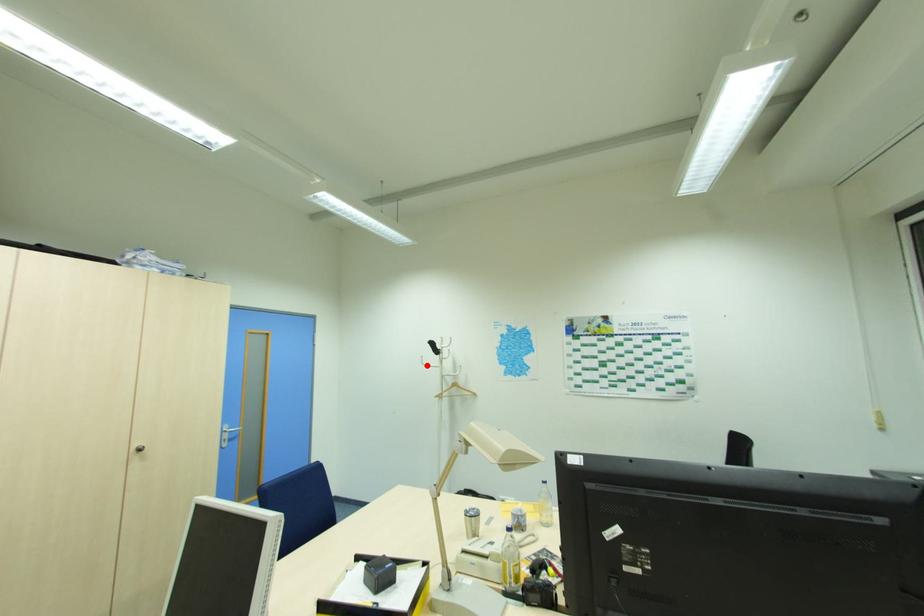
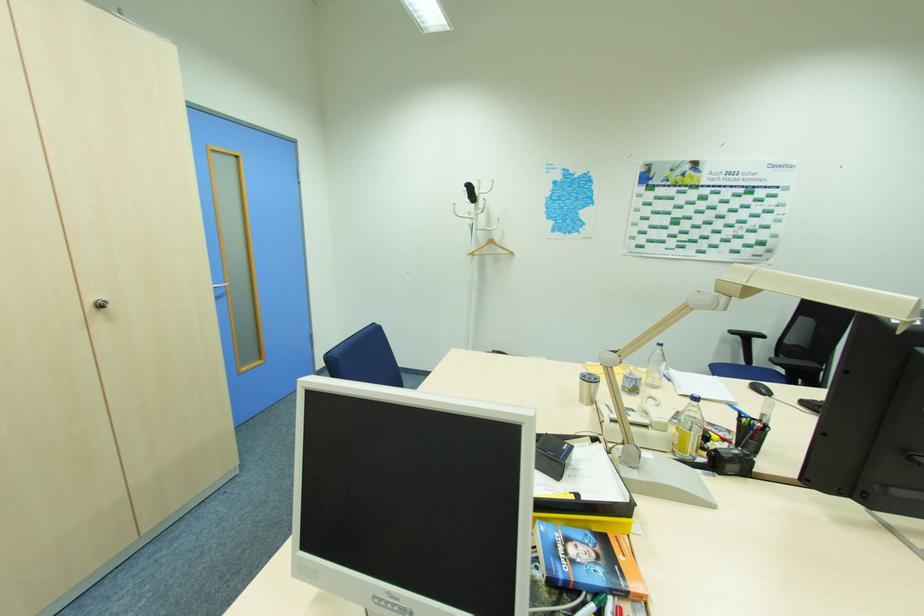
In the second image, find the point that corresponds to the highlighted location in the first image.

(459, 216)